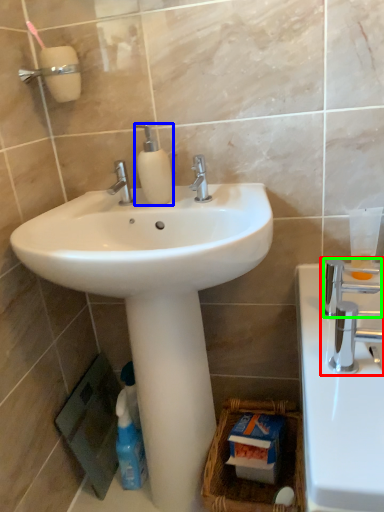
Question: Estimate the real-world distances between objects in this image. Which object is farther from tap (highlighted by a red box), soap dispenser (highlighted by a blue box) or plumbing fixture (highlighted by a green box)?

Choices:
 (A) soap dispenser
 (B) plumbing fixture

Answer: (A)